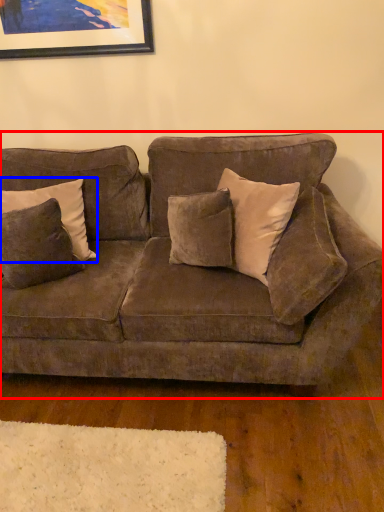
Question: Which object appears closest to the camera in this image, studio couch (highlighted by a red box) or pillow (highlighted by a blue box)?

Choices:
 (A) studio couch
 (B) pillow

Answer: (A)